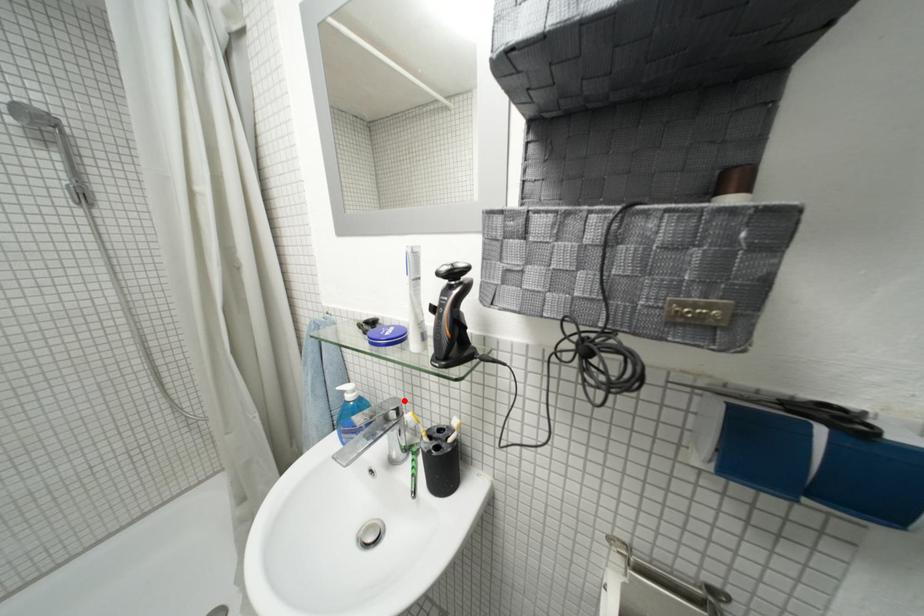
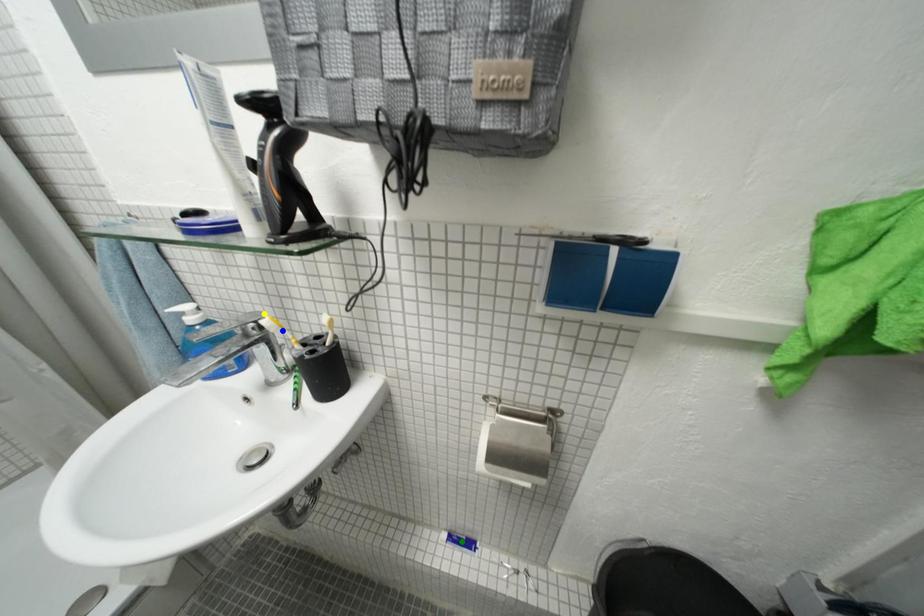
Question: I am providing you with two images of the same scene from different viewpoints. A red point is marked on the first image. You are given multiple points on the second image. In image 2, which mark is for the same physical point as the one in image 1?

Choices:
 (A) yellow point
 (B) green point
 (C) blue point

Answer: (A)